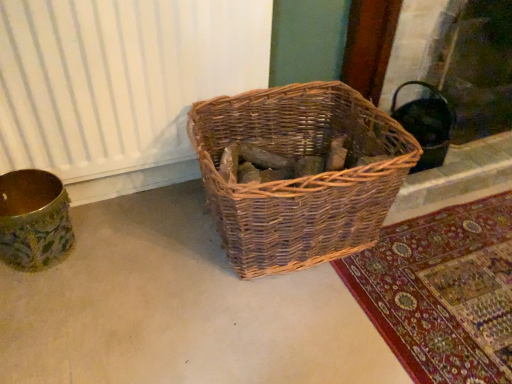
Locate an element on the screen. The height and width of the screenshot is (384, 512). vacant area that is in front of natural woven basket at center is located at coordinates (287, 330).